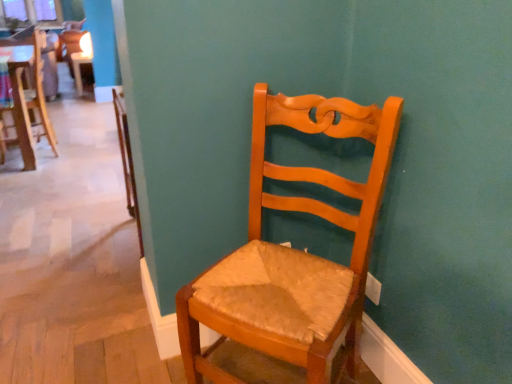
Question: From a real-world perspective, does wooden chair at center, the first chair viewed from the left, stand above wooden chair at center, the second chair positioned from the right?

Choices:
 (A) no
 (B) yes

Answer: (A)

Question: Is wooden chair at center, the 3th chair when ordered from bottom to top, closer to camera compared to wooden chair at center, the 2th chair when ordered from top to bottom?

Choices:
 (A) no
 (B) yes

Answer: (A)

Question: Is wooden chair at center, the 3th chair viewed from the right, bigger than wooden chair at center, the second chair in the back-to-front sequence?

Choices:
 (A) no
 (B) yes

Answer: (A)

Question: Is wooden chair at center, the first chair from the top, thinner than wooden chair at center, the second chair in the back-to-front sequence?

Choices:
 (A) yes
 (B) no

Answer: (A)

Question: Considering the relative sizes of wooden chair at center, the first chair viewed from the left, and wooden chair at center, the second chair in the back-to-front sequence, in the image provided, is wooden chair at center, the first chair viewed from the left, shorter than wooden chair at center, the second chair in the back-to-front sequence,?

Choices:
 (A) no
 (B) yes

Answer: (B)

Question: From the image's perspective, is wooden chair with woven seat cushion at center, the third chair positioned from the left, above or below wooden chair at center, the first chair from the top?

Choices:
 (A) above
 (B) below

Answer: (B)

Question: From a real-world perspective, is wooden chair with woven seat cushion at center, arranged as the first chair when ordered from the bottom, positioned above or below wooden chair at center, the 3th chair when ordered from bottom to top?

Choices:
 (A) above
 (B) below

Answer: (A)

Question: In the image, is wooden chair with woven seat cushion at center, acting as the 3th chair starting from the top, positioned in front of or behind wooden chair at center, the 3th chair when ordered from bottom to top?

Choices:
 (A) front
 (B) behind

Answer: (A)

Question: Considering the positions of wooden chair with woven seat cushion at center, arranged as the first chair when ordered from the bottom, and wooden chair at center, the first chair viewed from the left, in the image, is wooden chair with woven seat cushion at center, arranged as the first chair when ordered from the bottom, taller or shorter than wooden chair at center, the first chair viewed from the left,?

Choices:
 (A) tall
 (B) short

Answer: (A)

Question: Considering the positions of point (78, 36) and point (12, 104), is point (78, 36) closer or farther from the camera than point (12, 104)?

Choices:
 (A) farther
 (B) closer

Answer: (A)

Question: In terms of width, does wooden chair at center, the first chair from the top, look wider or thinner when compared to wooden chair at center, the second chair in the back-to-front sequence?

Choices:
 (A) thin
 (B) wide

Answer: (A)

Question: Is wooden chair at center, the first chair from the top, in front of or behind wooden chair at center, placed as the second chair when sorted from bottom to top, in the image?

Choices:
 (A) behind
 (B) front

Answer: (A)

Question: Would you say wooden chair at center, the first chair viewed from the left, is to the left or to the right of wooden chair at center, placed as the second chair when sorted from bottom to top, in the picture?

Choices:
 (A) left
 (B) right

Answer: (A)

Question: In terms of size, does wooden chair at center, marked as the third chair in a front-to-back arrangement, appear bigger or smaller than wooden chair with woven seat cushion at center, which ranks as the first chair in front-to-back order?

Choices:
 (A) small
 (B) big

Answer: (A)

Question: Is point (89, 51) closer or farther from the camera than point (284, 117)?

Choices:
 (A) closer
 (B) farther

Answer: (B)